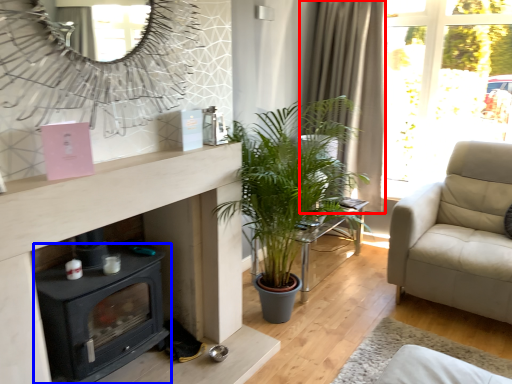
Question: Which point is closer to the camera, curtain (highlighted by a red box) or wood burning stove (highlighted by a blue box)?

Choices:
 (A) curtain
 (B) wood burning stove

Answer: (B)